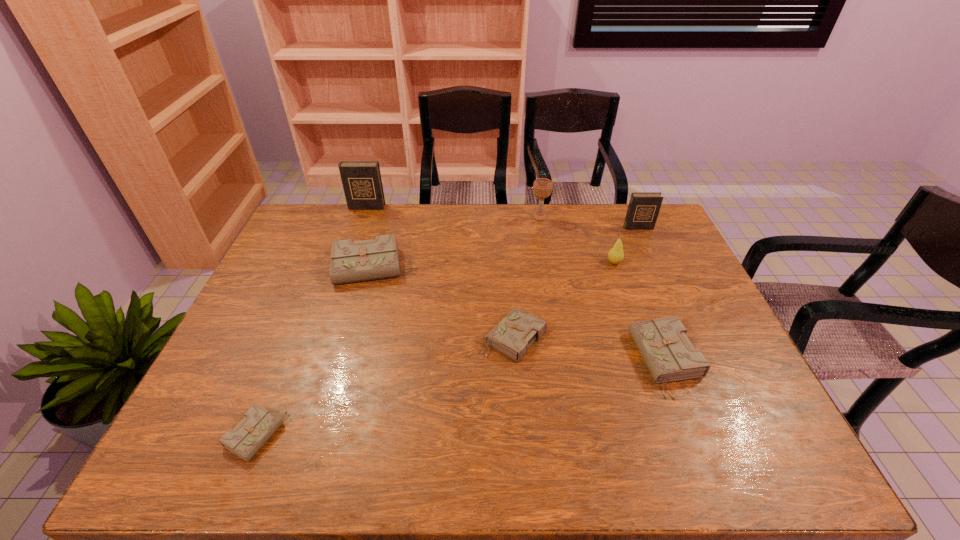
Identify the location of the bigger dark diary. This screenshot has width=960, height=540. (361, 180).

Identify the location of the farthest object. (361, 180).

Image resolution: width=960 pixels, height=540 pixels. I want to click on beige chalice, so click(542, 187).

The width and height of the screenshot is (960, 540). Find the location of `the fifth object from left to right`. the fifth object from left to right is located at coordinates (542, 187).

In order to click on the second tallest diary in this screenshot , I will do coord(643,209).

You are a GUI agent. You are given a task and a screenshot of the screen. Output one action in this format:
    pyautogui.click(x=<x>, y=<y>)
    Task: Click on the third farthest object
    
    Given the screenshot: What is the action you would take?
    pyautogui.click(x=643, y=209)

The image size is (960, 540). What are the coordinates of `pear` in the screenshot? It's located at (615, 255).

The width and height of the screenshot is (960, 540). Identify the location of the farthest green diary. (357, 261).

Identify the location of the fourth shortest diary. (357, 261).

Locate an element on the screen. The width and height of the screenshot is (960, 540). the fourth tallest diary is located at coordinates (663, 344).